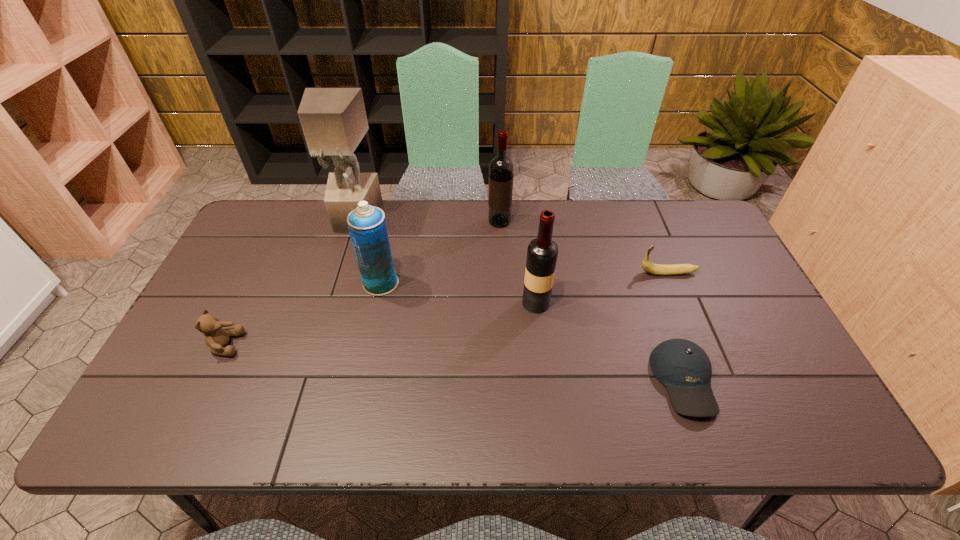
What are the coordinates of `sculpture` in the screenshot? It's located at (334, 121).

Where is `the fourth object from right to left`? Image resolution: width=960 pixels, height=540 pixels. the fourth object from right to left is located at coordinates (501, 168).

Identify the location of the farther wine bottle. (501, 168).

The image size is (960, 540). What are the coordinates of `the fifth object from left to right` in the screenshot? It's located at (542, 253).

I want to click on the right wine bottle, so click(542, 253).

The width and height of the screenshot is (960, 540). Find the location of `aerosol can`. aerosol can is located at coordinates (366, 224).

At what (x,y) coordinates should I click in order to perform the action: click on the leftmost object. Please return your answer as a coordinate pair (x, y). This screenshot has height=540, width=960. Looking at the image, I should click on (216, 338).

The image size is (960, 540). What are the coordinates of `banana` in the screenshot? It's located at (656, 269).

What are the coordinates of `baseball cap` in the screenshot? It's located at click(x=684, y=368).

In order to click on free space located on the front-facing side of the tallest object in this screenshot , I will do `click(332, 294)`.